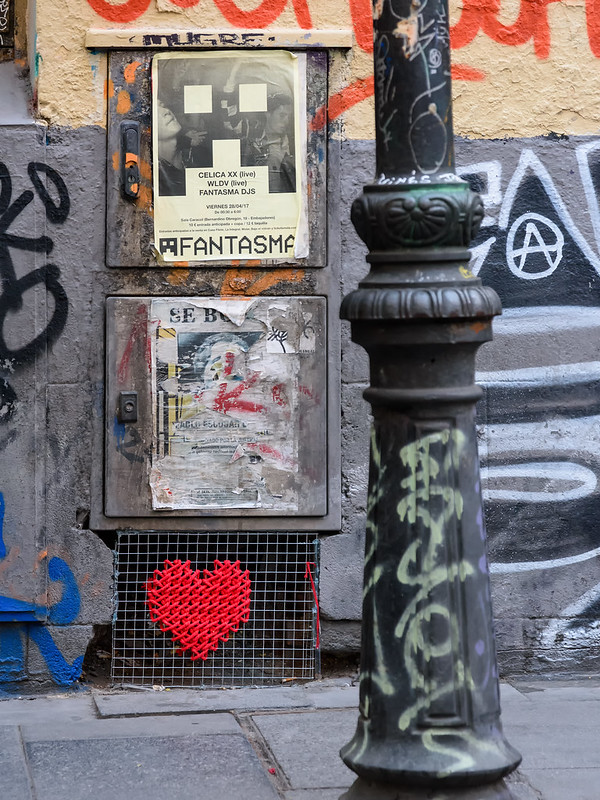
Find the location of a particular element. Image resolution: width=600 pixels, height=800 pixels. poster is located at coordinates (224, 186).